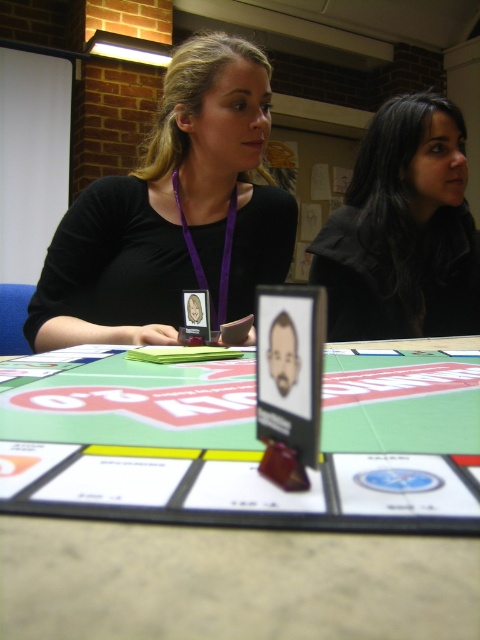
Question: Which point is closer to the camera taking this photo?

Choices:
 (A) (238, 92)
 (B) (112, 628)
 (C) (358, 280)

Answer: (B)

Question: Does matte black lanyard at center have a smaller size compared to black matte hair at upper right?

Choices:
 (A) no
 (B) yes

Answer: (A)

Question: Among these objects, which one is nearest to the camera?

Choices:
 (A) green board game at center
 (B) black matte hair at upper right
 (C) matte black lanyard at center

Answer: (A)

Question: Estimate the real-world distances between objects in this image. Which object is farther from the green board game at center?

Choices:
 (A) matte black lanyard at center
 (B) black matte hair at upper right

Answer: (B)

Question: Does green board game at center appear over black matte hair at upper right?

Choices:
 (A) yes
 (B) no

Answer: (B)

Question: Does matte black lanyard at center have a larger size compared to black matte hair at upper right?

Choices:
 (A) yes
 (B) no

Answer: (A)